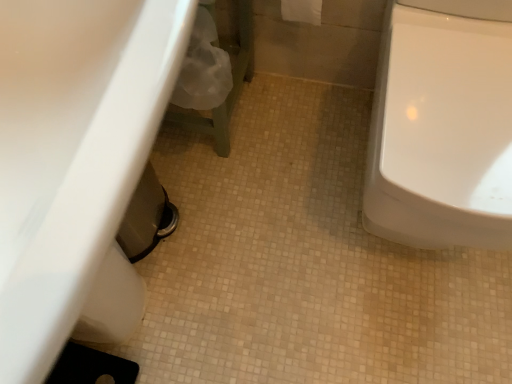
Question: Based on their sizes in the image, would you say white glossy toilet at right is bigger or smaller than white glossy sink at lower left?

Choices:
 (A) small
 (B) big

Answer: (B)

Question: Is white glossy toilet at right inside or outside of white glossy sink at lower left?

Choices:
 (A) outside
 (B) inside

Answer: (A)

Question: Which object is positioned farthest from the white fabric toilet paper at upper center?

Choices:
 (A) white glossy sink at lower left
 (B) white glossy toilet at right

Answer: (A)

Question: Which object is positioned closest to the white glossy sink at lower left?

Choices:
 (A) white glossy toilet at right
 (B) white fabric toilet paper at upper center

Answer: (A)